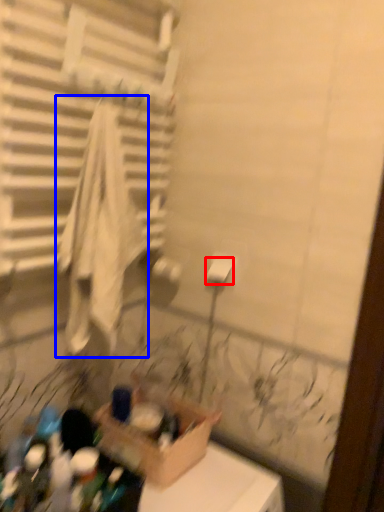
Question: Which of the following is the farthest to the observer, toilet paper (highlighted by a red box) or bath towel (highlighted by a blue box)?

Choices:
 (A) toilet paper
 (B) bath towel

Answer: (A)